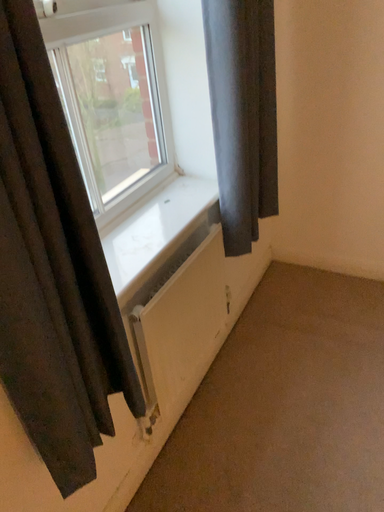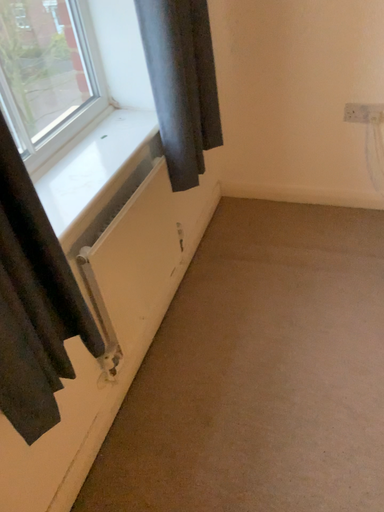
Question: How did the camera likely rotate when shooting the video?

Choices:
 (A) rotated left
 (B) rotated right

Answer: (B)